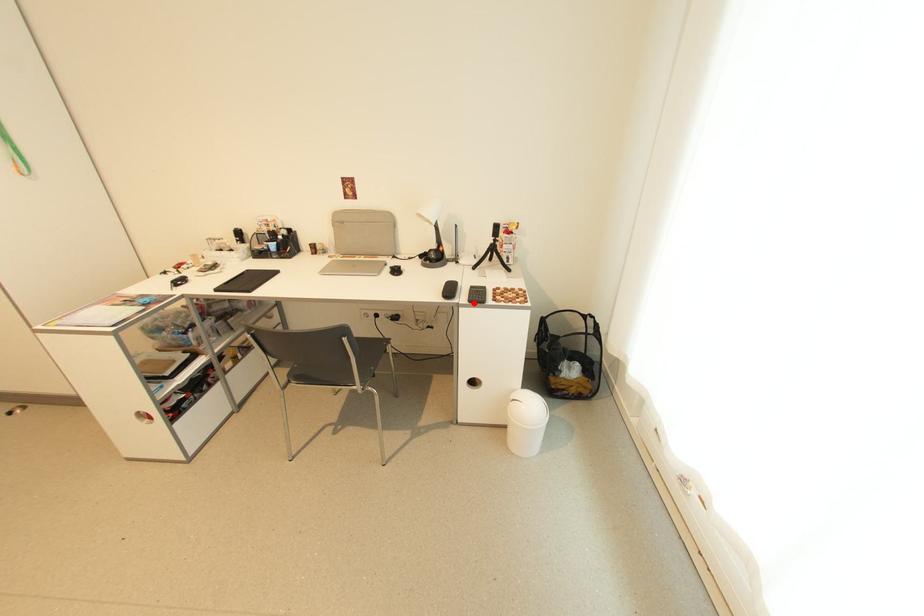
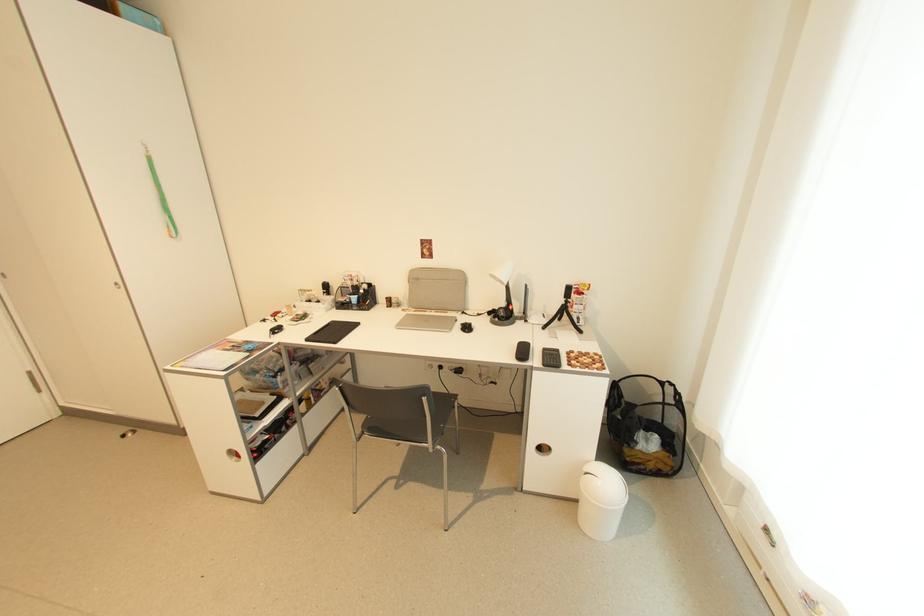
The point at the highlighted location is marked in the first image. Where is the corresponding point in the second image?

(548, 367)